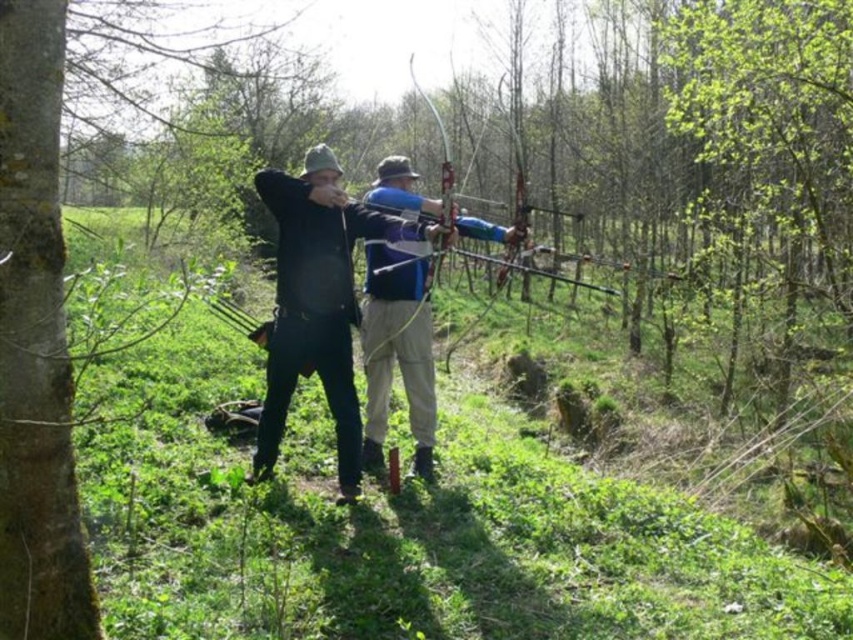
You are an archer standing in the grassy area and see the blue fabric bow at center and the matte blue bow at center. Which bow is positioned lower in the image?

The blue fabric bow at center is positioned below the matte blue bow at center, so it is lower in the image.